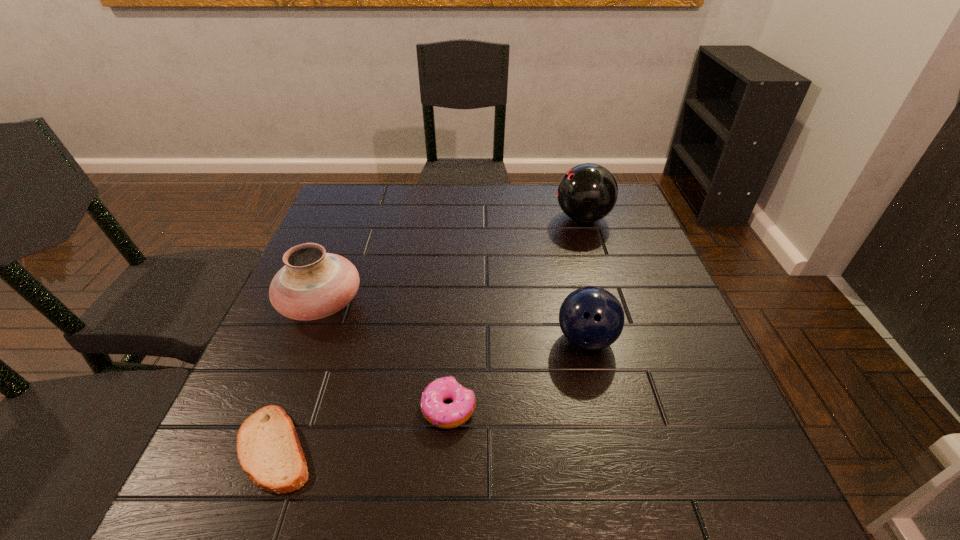
At what (x,y) coordinates should I click in order to perform the action: click on object that is at the far right corner. Please return your answer as a coordinate pair (x, y). This screenshot has height=540, width=960. Looking at the image, I should click on (588, 192).

In order to click on vacant space at the far edge of the desktop in this screenshot , I will do `click(421, 197)`.

In the image, there is a desktop. In order to click on vacant region at the near edge in this screenshot , I will do `click(352, 500)`.

The image size is (960, 540). I want to click on vacant point at the left edge, so click(268, 340).

Identify the location of free space at the right edge. (699, 356).

At what (x,y) coordinates should I click in order to perform the action: click on free space at the near left corner. Please return your answer as a coordinate pair (x, y). Looking at the image, I should click on (183, 514).

The height and width of the screenshot is (540, 960). I want to click on vacant space that's between the pottery and the farthest object, so [x=452, y=261].

Identify the location of vacant region between the pottery and the shorter bowling ball. (454, 322).

The width and height of the screenshot is (960, 540). What are the coordinates of `empty space that is in between the pita bread and the pottery` in the screenshot? It's located at (299, 376).

I want to click on vacant area between the doughnut and the nearer bowling ball, so click(x=517, y=374).